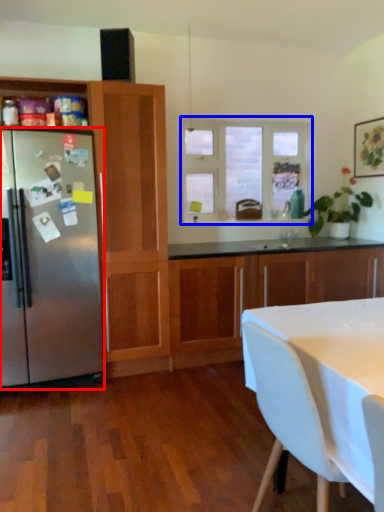
Question: Which of the following is the closest to the observer, refrigerator (highlighted by a red box) or window (highlighted by a blue box)?

Choices:
 (A) refrigerator
 (B) window

Answer: (A)